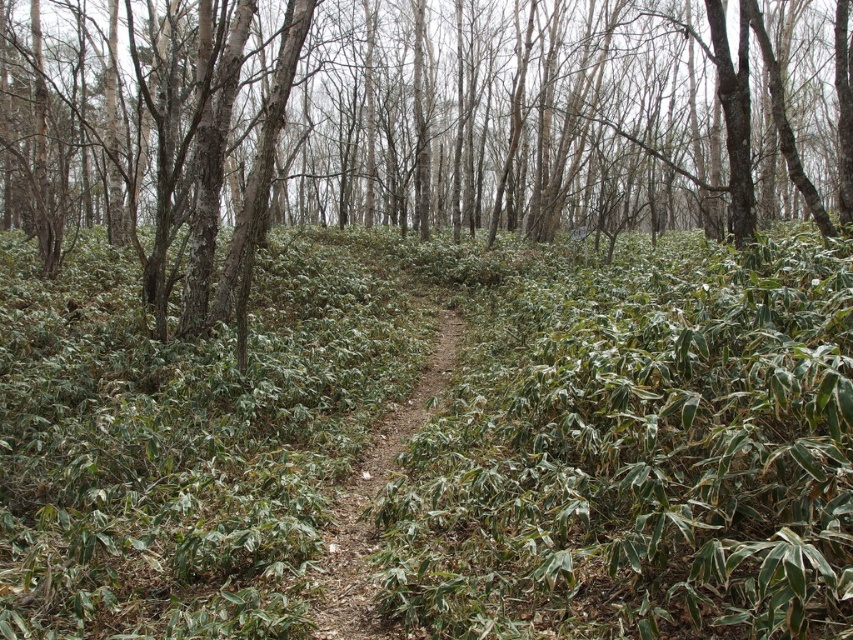
Question: Is green matte tree at center to the right of dirt path at center from the viewer's perspective?

Choices:
 (A) yes
 (B) no

Answer: (B)

Question: Does green matte tree at center have a smaller size compared to dirt path at center?

Choices:
 (A) yes
 (B) no

Answer: (B)

Question: Which object is farther from the camera taking this photo?

Choices:
 (A) dirt path at center
 (B) green matte tree at center

Answer: (B)

Question: From the image, what is the correct spatial relationship of green matte tree at center in relation to dirt path at center?

Choices:
 (A) below
 (B) above

Answer: (B)